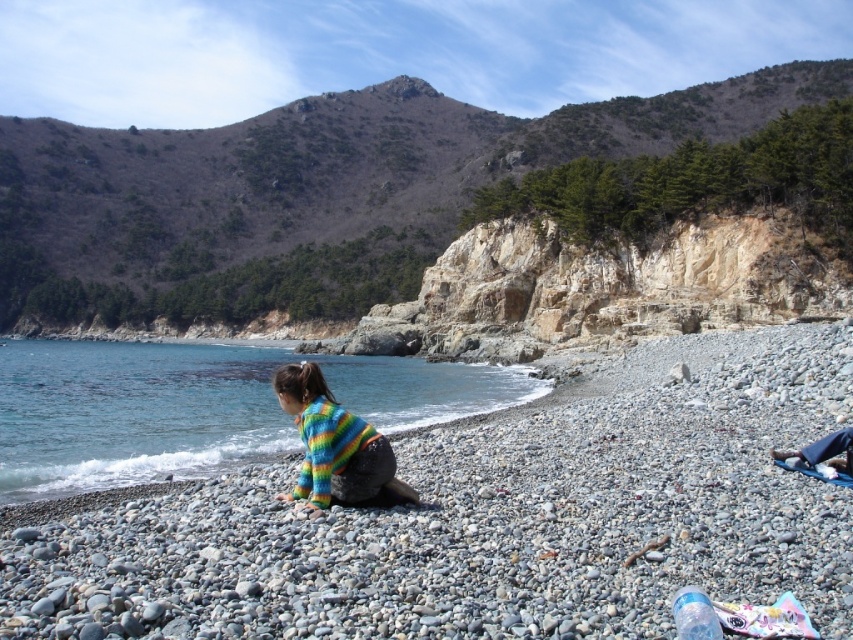
Does smooth pebbles at center appear under blue fabric pants at lower right?

Correct, smooth pebbles at center is located below blue fabric pants at lower right.

Who is shorter, smooth pebbles at center or blue fabric pants at lower right?

blue fabric pants at lower right is shorter.

Measure the distance between point (412, 440) and camera.

A distance of 27.19 meters exists between point (412, 440) and camera.

The height and width of the screenshot is (640, 853). Identify the location of smooth pebbles at center. (490, 518).

The height and width of the screenshot is (640, 853). What do you see at coordinates (334, 444) in the screenshot? I see `multicolored knitted sweater at center` at bounding box center [334, 444].

Is multicolored knitted sweater at center below blue fabric pants at lower right?

Yes.

Find the location of a particular element. Image resolution: width=853 pixels, height=640 pixels. multicolored knitted sweater at center is located at coordinates tap(334, 444).

Where is `multicolored knitted sweater at center`? This screenshot has width=853, height=640. multicolored knitted sweater at center is located at coordinates (334, 444).

Is smooth pebbles at center positioned behind multicolored knitted sweater at center?

That is False.

Describe the element at coordinates (490, 518) in the screenshot. The height and width of the screenshot is (640, 853). I see `smooth pebbles at center` at that location.

You are a GUI agent. You are given a task and a screenshot of the screen. Output one action in this format:
    pyautogui.click(x=<x>, y=<y>)
    Task: Click on the smooth pebbles at center
    The image size is (853, 640).
    Given the screenshot: What is the action you would take?
    pyautogui.click(x=490, y=518)